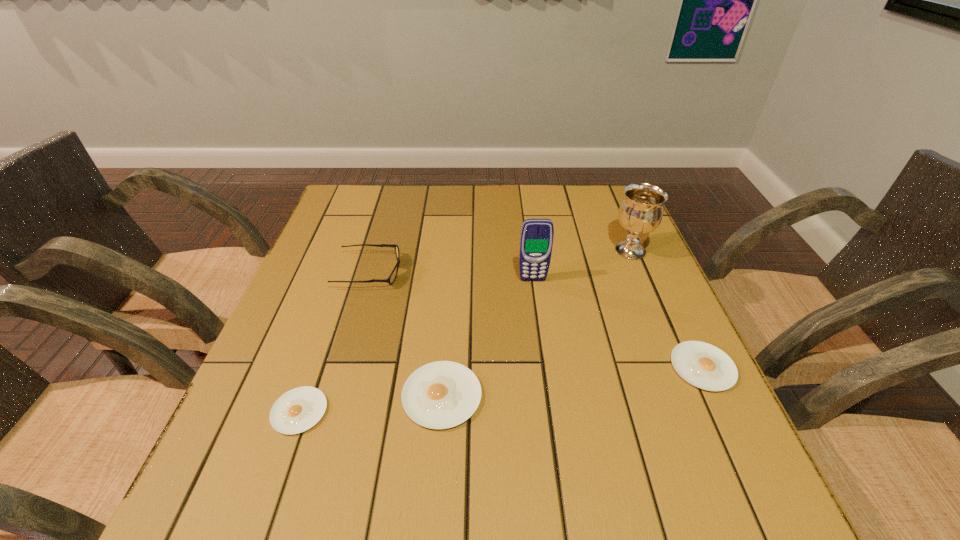
I want to click on vacant region at the far edge of the desktop, so click(x=523, y=212).

Locate an element on the screen. free space at the near edge of the desktop is located at coordinates (512, 451).

Find the location of a particular element. vacant space at the left edge is located at coordinates (362, 229).

You are a GUI agent. You are given a task and a screenshot of the screen. Output one action in this format:
    pyautogui.click(x=<x>, y=<y>)
    Task: Click on the vacant region at the right edge of the desktop
    The height and width of the screenshot is (540, 960).
    Given the screenshot: What is the action you would take?
    pyautogui.click(x=685, y=334)

The image size is (960, 540). I want to click on free space at the far left corner of the desktop, so click(362, 227).

Find the location of a particular element. This screenshot has width=960, height=540. vacant area that lies between the sunglasses and the fifth tallest object is located at coordinates (536, 319).

The height and width of the screenshot is (540, 960). Find the location of `free spot between the chalice and the rightmost egg yolk`. free spot between the chalice and the rightmost egg yolk is located at coordinates (666, 309).

This screenshot has height=540, width=960. Identify the location of free point between the rightmost egg yolk and the fourth shortest object. (536, 319).

Find the location of a particular element. The width and height of the screenshot is (960, 540). vacant space that is in between the chalice and the fourth shortest object is located at coordinates (500, 261).

This screenshot has height=540, width=960. I want to click on unoccupied position between the third tallest object and the second egg yolk from left to right, so click(x=405, y=334).